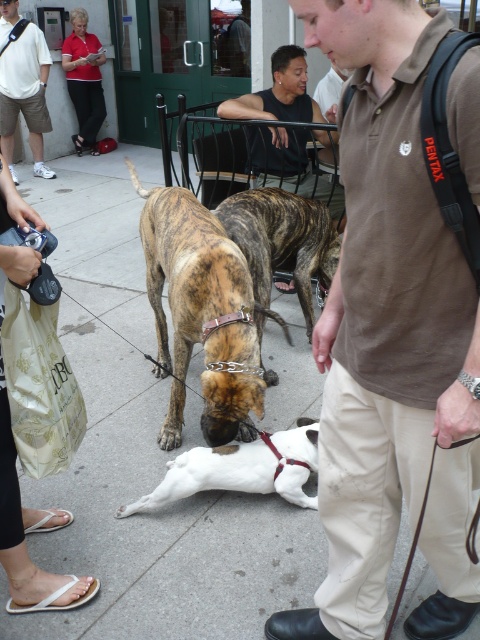
Which is below, brown cotton shirt at center or matte black shirt at upper left?

brown cotton shirt at center is below.

Can you confirm if brown cotton shirt at center is thinner than matte black shirt at upper left?

Yes.

Where is `brown cotton shirt at center`? This screenshot has width=480, height=640. brown cotton shirt at center is located at coordinates (391, 340).

The width and height of the screenshot is (480, 640). I want to click on brown cotton shirt at center, so click(x=391, y=340).

Can you confirm if white matte dog at center is shorter than matte black shirt at upper left?

Yes, white matte dog at center is shorter than matte black shirt at upper left.

Find the location of a particular element. white matte dog at center is located at coordinates (240, 468).

Is point (141, 509) positioned before point (8, 52)?

Yes, point (141, 509) is in front of point (8, 52).

The width and height of the screenshot is (480, 640). I want to click on white matte dog at center, so click(x=240, y=468).

Between point (8, 419) and point (227, 481), which one is positioned behind?

The point (227, 481) is behind.

Is point (24, 563) behind point (196, 486)?

No, it is not.

This screenshot has height=640, width=480. What are the coordinates of `white fabric bag at lower left` in the screenshot? It's located at (24, 534).